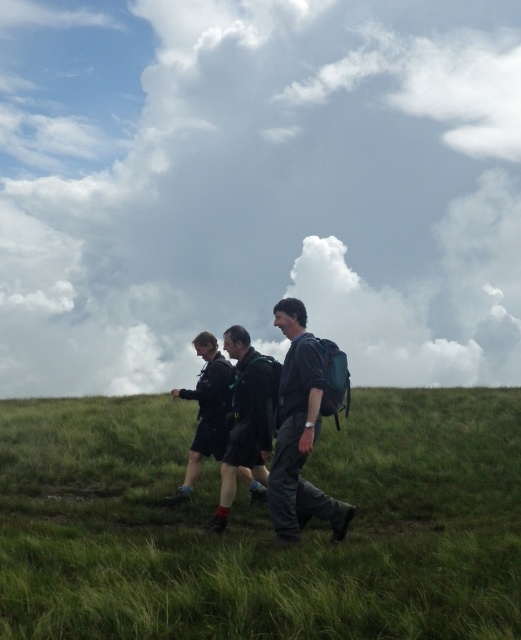
Question: Is green grassy at center thinner than dark blue backpack at center?

Choices:
 (A) yes
 (B) no

Answer: (B)

Question: Can you confirm if cloudy sky at upper center is wider than dark blue backpack at center?

Choices:
 (A) no
 (B) yes

Answer: (B)

Question: Which point is closer to the camera taking this photo?

Choices:
 (A) (307, 433)
 (B) (230, 179)

Answer: (A)

Question: Considering the real-world distances, which object is farthest from the dark gray fabric backpack at center?

Choices:
 (A) dark blue backpack at center
 (B) cloudy sky at upper center
 (C) green grassy at center

Answer: (B)

Question: Which of the following is the closest to the observer?

Choices:
 (A) green grassy at center
 (B) dark gray fabric backpack at center

Answer: (A)

Question: Is green grassy at center positioned at the back of dark gray fabric backpack at center?

Choices:
 (A) yes
 (B) no

Answer: (B)